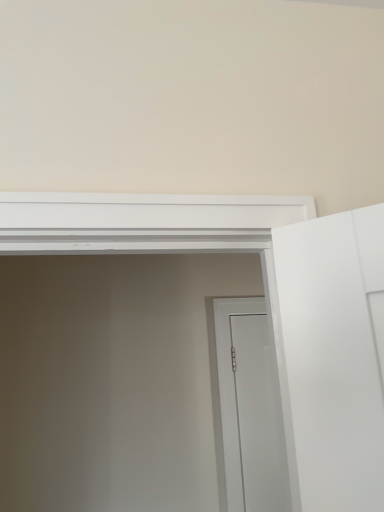
Consider the image. In order to face white matte door at center, should I rotate leftwards or rightwards?

To face it directly, rotate right by 8.765 degrees.

This screenshot has height=512, width=384. I want to click on white matte door at center, so click(248, 408).

This screenshot has width=384, height=512. What do you see at coordinates (248, 408) in the screenshot? I see `white matte door at center` at bounding box center [248, 408].

Measure the distance between white matte door at center and camera.

white matte door at center and camera are 5.84 feet apart from each other.

Locate an element on the screen. white matte door at center is located at coordinates pyautogui.click(x=248, y=408).